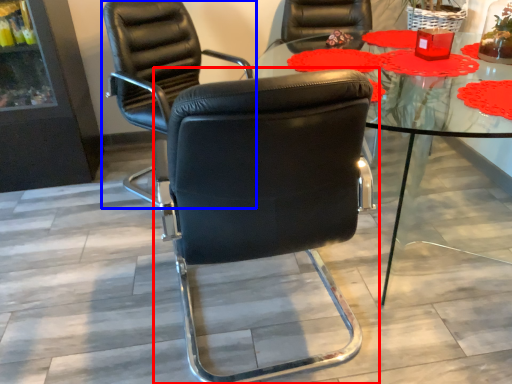
Question: Which object is further to the camera taking this photo, chair (highlighted by a red box) or chair (highlighted by a blue box)?

Choices:
 (A) chair
 (B) chair

Answer: (B)